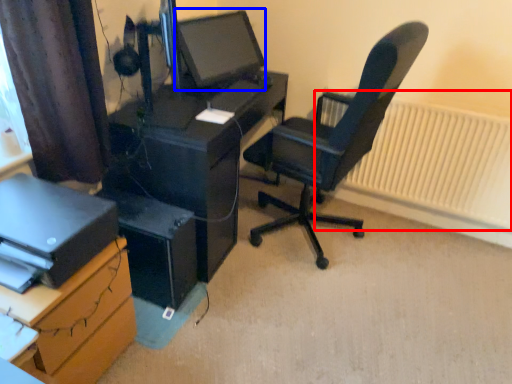
Question: Which object is closer to the camera taking this photo, radiator (highlighted by a red box) or computer monitor (highlighted by a blue box)?

Choices:
 (A) radiator
 (B) computer monitor

Answer: (B)